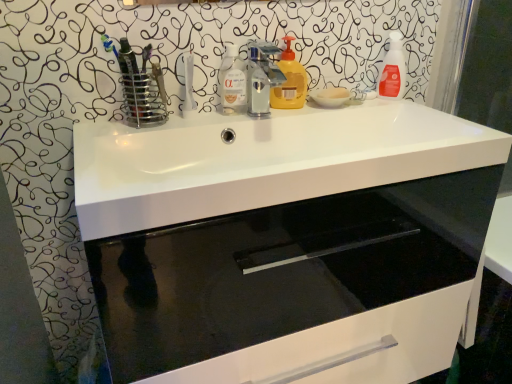
Question: Which direction should I rotate to look at transparent liquid at center, the third cleaning product when ordered from right to left, — up or down?

Choices:
 (A) up
 (B) down

Answer: (A)

Question: From a real-world perspective, is white glossy cabinet at center over white glossy sink at center?

Choices:
 (A) yes
 (B) no

Answer: (B)

Question: Does white glossy cabinet at center have a lesser height compared to white glossy sink at center?

Choices:
 (A) yes
 (B) no

Answer: (B)

Question: From the image's perspective, is white glossy cabinet at center below white glossy sink at center?

Choices:
 (A) yes
 (B) no

Answer: (A)

Question: Can you see white glossy cabinet at center touching white glossy sink at center?

Choices:
 (A) yes
 (B) no

Answer: (B)

Question: Is white glossy cabinet at center positioned with its back to white glossy sink at center?

Choices:
 (A) yes
 (B) no

Answer: (B)

Question: Does white glossy cabinet at center have a lesser width compared to white glossy sink at center?

Choices:
 (A) yes
 (B) no

Answer: (A)

Question: Is transparent liquid at center, positioned as the first cleaning product in left-to-right order, outside of white glossy sink at center?

Choices:
 (A) no
 (B) yes

Answer: (B)

Question: Is the depth of transparent liquid at center, the third cleaning product when ordered from right to left, greater than that of white glossy sink at center?

Choices:
 (A) no
 (B) yes

Answer: (B)

Question: Does transparent liquid at center, the third cleaning product when ordered from right to left, have a lesser height compared to white glossy sink at center?

Choices:
 (A) no
 (B) yes

Answer: (A)

Question: Is transparent liquid at center, positioned as the first cleaning product in left-to-right order, positioned with its back to white glossy sink at center?

Choices:
 (A) no
 (B) yes

Answer: (A)

Question: Does transparent liquid at center, the third cleaning product when ordered from right to left, have a lesser width compared to white glossy sink at center?

Choices:
 (A) yes
 (B) no

Answer: (A)

Question: Considering the relative positions of transparent liquid at center, positioned as the first cleaning product in left-to-right order, and white glossy sink at center in the image provided, is transparent liquid at center, positioned as the first cleaning product in left-to-right order, to the right of white glossy sink at center from the viewer's perspective?

Choices:
 (A) no
 (B) yes

Answer: (A)

Question: Is there a large distance between white glossy sink at center and translucent orange spray bottle at upper right, acting as the 3th cleaning product starting from the left?

Choices:
 (A) yes
 (B) no

Answer: (B)